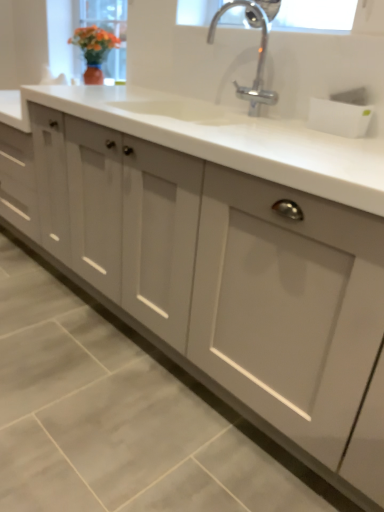
Question: Should I look upward or downward to see clear glass window screen at upper center?

Choices:
 (A) down
 (B) up

Answer: (B)

Question: Is clear glass window screen at upper center aimed at chrome metallic faucet at upper center?

Choices:
 (A) no
 (B) yes

Answer: (B)

Question: Is clear glass window screen at upper center facing away from chrome metallic faucet at upper center?

Choices:
 (A) yes
 (B) no

Answer: (B)

Question: Is clear glass window screen at upper center smaller than chrome metallic faucet at upper center?

Choices:
 (A) yes
 (B) no

Answer: (A)

Question: Is clear glass window screen at upper center further to camera compared to chrome metallic faucet at upper center?

Choices:
 (A) yes
 (B) no

Answer: (A)

Question: Does clear glass window screen at upper center appear on the left side of chrome metallic faucet at upper center?

Choices:
 (A) no
 (B) yes

Answer: (A)

Question: From a real-world perspective, is clear glass window screen at upper center on chrome metallic faucet at upper center?

Choices:
 (A) no
 (B) yes

Answer: (B)

Question: Does chrome metallic faucet at upper center appear on the right side of clear glass window screen at upper center?

Choices:
 (A) no
 (B) yes

Answer: (A)

Question: Can you confirm if chrome metallic faucet at upper center is smaller than clear glass window screen at upper center?

Choices:
 (A) yes
 (B) no

Answer: (B)

Question: Is chrome metallic faucet at upper center taller than clear glass window screen at upper center?

Choices:
 (A) yes
 (B) no

Answer: (A)

Question: Is chrome metallic faucet at upper center looking in the opposite direction of clear glass window screen at upper center?

Choices:
 (A) yes
 (B) no

Answer: (A)

Question: Is chrome metallic faucet at upper center bigger than clear glass window screen at upper center?

Choices:
 (A) yes
 (B) no

Answer: (A)

Question: Is chrome metallic faucet at upper center thinner than clear glass window screen at upper center?

Choices:
 (A) no
 (B) yes

Answer: (B)

Question: From the image's perspective, relative to clear glass window screen at upper center, is chrome metallic faucet at upper center above or below?

Choices:
 (A) below
 (B) above

Answer: (A)